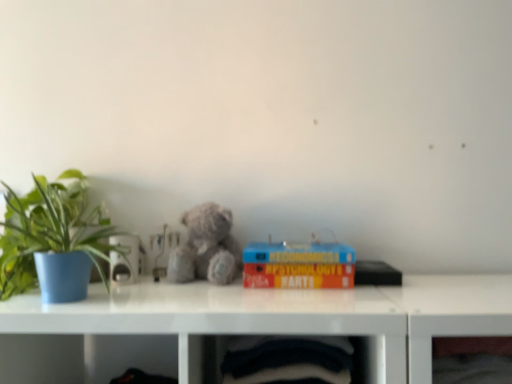
Question: Is fuzzy gray teddy bear at center taller than hardcover book at center?

Choices:
 (A) yes
 (B) no

Answer: (A)

Question: Can you confirm if fuzzy gray teddy bear at center is wider than hardcover book at center?

Choices:
 (A) no
 (B) yes

Answer: (A)

Question: Can you confirm if fuzzy gray teddy bear at center is smaller than hardcover book at center?

Choices:
 (A) yes
 (B) no

Answer: (A)

Question: Is fuzzy gray teddy bear at center aimed at hardcover book at center?

Choices:
 (A) no
 (B) yes

Answer: (A)

Question: Considering the relative sizes of fuzzy gray teddy bear at center and hardcover book at center in the image provided, is fuzzy gray teddy bear at center shorter than hardcover book at center?

Choices:
 (A) yes
 (B) no

Answer: (B)

Question: Based on their positions, is hardcover book at center located to the left or right of fuzzy gray teddy bear at center?

Choices:
 (A) left
 (B) right

Answer: (B)

Question: Considering the positions of hardcover book at center and fuzzy gray teddy bear at center in the image, is hardcover book at center bigger or smaller than fuzzy gray teddy bear at center?

Choices:
 (A) small
 (B) big

Answer: (B)

Question: In terms of width, does hardcover book at center look wider or thinner when compared to fuzzy gray teddy bear at center?

Choices:
 (A) thin
 (B) wide

Answer: (B)

Question: Is hardcover book at center taller or shorter than fuzzy gray teddy bear at center?

Choices:
 (A) tall
 (B) short

Answer: (B)

Question: Based on their sizes in the image, would you say hardcover book at center is bigger or smaller than green matte plant at left?

Choices:
 (A) big
 (B) small

Answer: (B)

Question: Is hardcover book at center in front of or behind green matte plant at left in the image?

Choices:
 (A) behind
 (B) front

Answer: (A)

Question: From a real-world perspective, is hardcover book at center physically located above or below green matte plant at left?

Choices:
 (A) above
 (B) below

Answer: (B)

Question: From the image's perspective, is hardcover book at center above or below green matte plant at left?

Choices:
 (A) above
 (B) below

Answer: (B)

Question: From a real-world perspective, is velvet-like black fabric at lower center, which is the first shelf in left-to-right order, above or below hardcover book at center?

Choices:
 (A) above
 (B) below

Answer: (B)

Question: Considering their positions, is velvet-like black fabric at lower center, which is the second shelf in right-to-left order, located in front of or behind hardcover book at center?

Choices:
 (A) front
 (B) behind

Answer: (A)